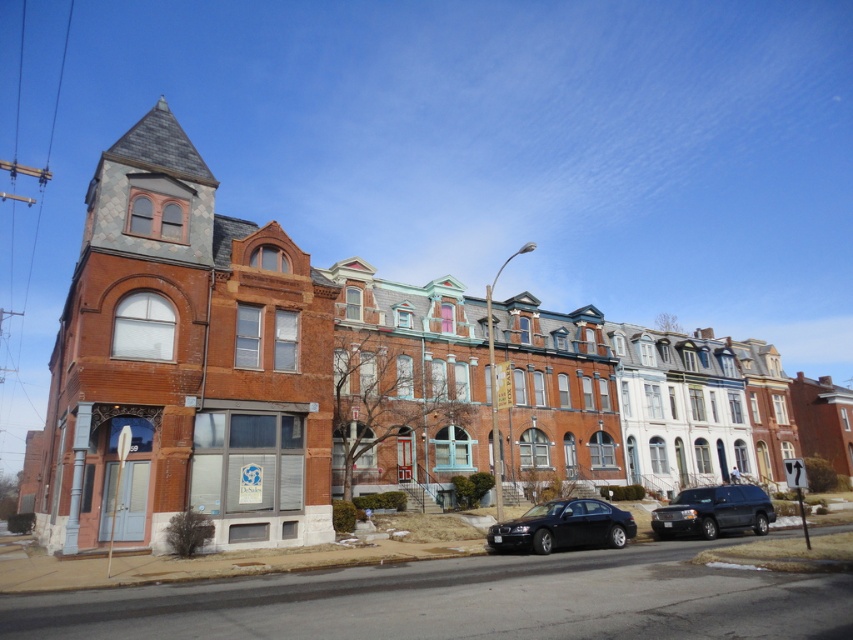
What is the color of the object located at point (563, 525) in the image?

The object at point (563, 525) is a shiny black sedan.

You are a delivery person trying to park your truck between the shiny black sedan at center and the shiny black suv at lower right. Can you fit your truck, which is 2.5 meters wide, in the space between them?

The shiny black sedan at center has a lesser width compared to shiny black suv at lower right. The total width between them would depend on their individual widths and the distance between them. However, since the sedan is narrower than the SUV, there might be enough space. But without knowing the exact distance between the vehicles, it is impossible to determine if the 2.5 meter truck can fit. Please check the actual space available.

You are a parking attendant who needs to fit a vehicle into a parking spot that is exactly 4.5 meters long. You have to choose between the shiny black sedan at center and the shiny black suv at lower right. Which vehicle can fit in the spot?

The shiny black sedan at center is shorter than the shiny black suv at lower right. Since the parking spot is 4.5 meters long, the sedan is more likely to fit as it is shorter than the SUV.